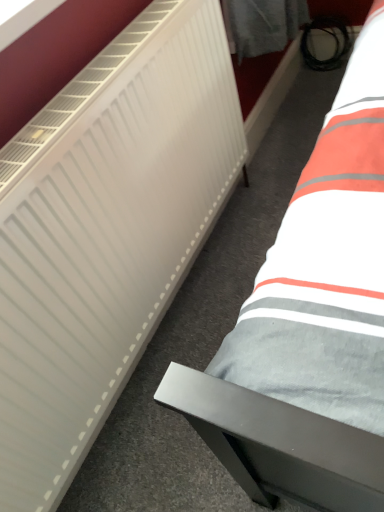
The image size is (384, 512). In order to click on free area below white matte radiator at left (from a real-world perspective) in this screenshot , I will do `click(178, 310)`.